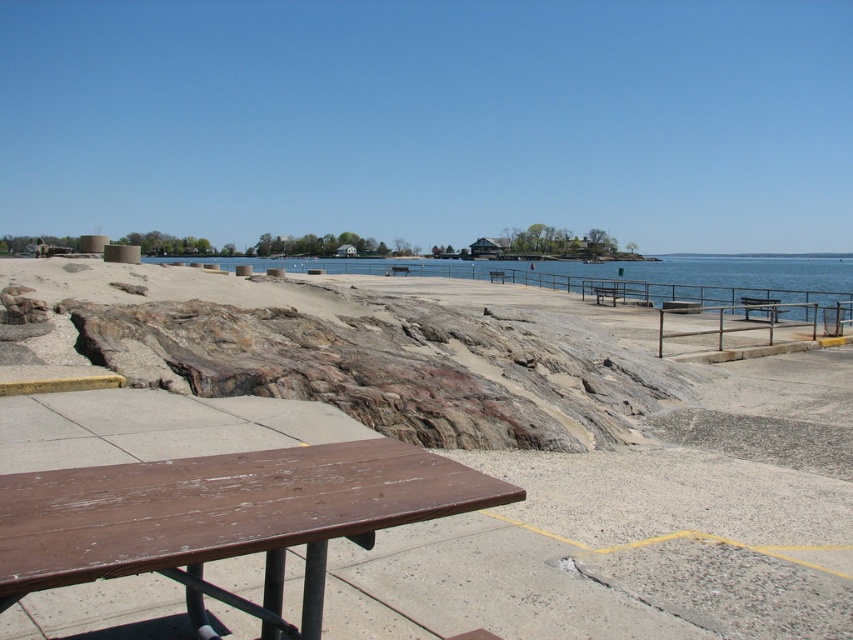
You are planning to set up a picnic blanket. You have a picnic blanket that is 2 meters wide. You see the wooden picnic table at lower left and the blue water at center. Which object can the blanket fit next to without overlapping?

The wooden picnic table at lower left has a width less than the blue water at center. Since the blanket is 2 meters wide, it can fit next to the blue water at center which is wider than the picnic table.

You are standing at the center of the waterfront scene. Which direction should you walk to reach the wooden picnic table at lower left?

The wooden picnic table at lower left is located at point (x=225, y=518), so you should walk towards the lower left direction to reach it.

You are standing at the wooden picnic table with a metal frame on the paved area. You see two points marked in the scene. Which point is closer to you, point (x=212, y=515) or point (x=503, y=272)?

Point (x=212, y=515) is in front of point (x=503, y=272), so it is closer to you.